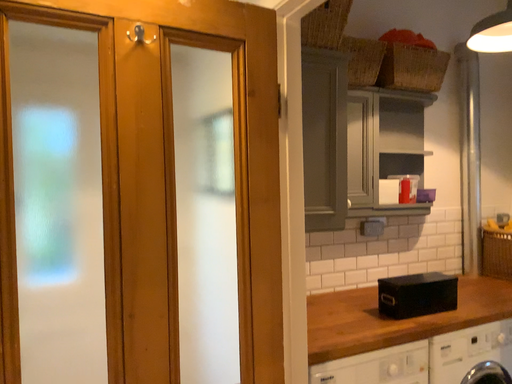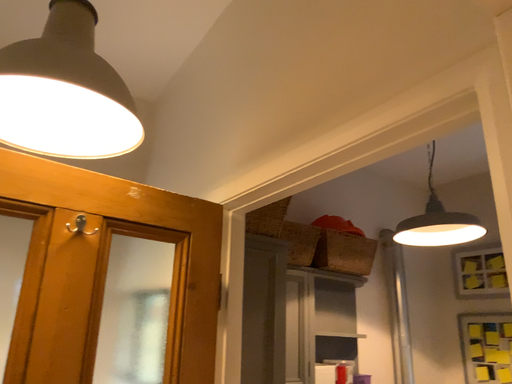
Question: How did the camera likely rotate when shooting the video?

Choices:
 (A) rotated downward
 (B) rotated upward

Answer: (B)